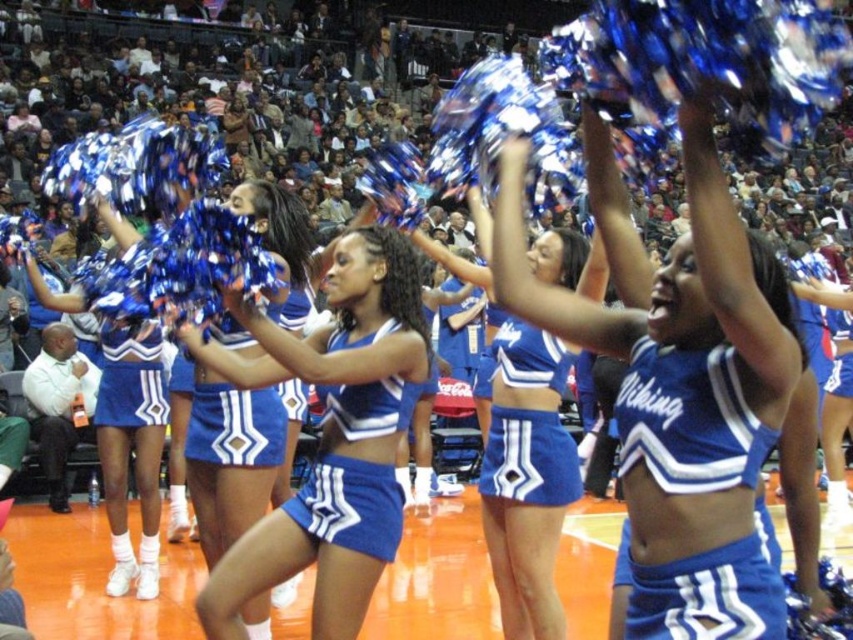
Looking at this image, you are a photographer at the event and want to capture a clear shot of the blue shiny fabric cheerleading outfit at center without the blue matte cheerleading uniform at center blocking it. From which direction should you position yourself to ensure the outfit is visible?

The blue shiny fabric cheerleading outfit at center is positioned under the blue matte cheerleading uniform at center. To avoid the uniform blocking the view, you should position yourself below the blue matte cheerleading uniform at center so that the outfit is visible beneath it.